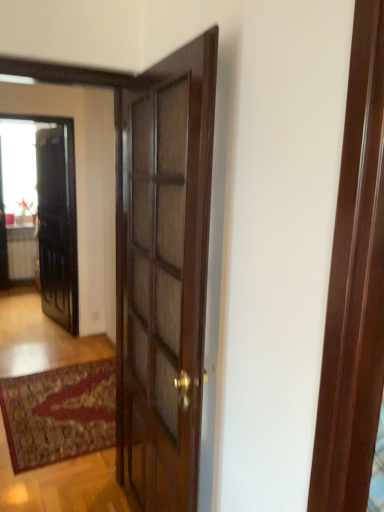
Question: From a real-world perspective, does black glossy elevator at left stand above transparent glass window at upper left?

Choices:
 (A) yes
 (B) no

Answer: (B)

Question: Is black glossy elevator at left next to transparent glass window at upper left and touching it?

Choices:
 (A) no
 (B) yes

Answer: (A)

Question: Is black glossy elevator at left facing towards transparent glass window at upper left?

Choices:
 (A) yes
 (B) no

Answer: (B)

Question: Is transparent glass window at upper left at the back of black glossy elevator at left?

Choices:
 (A) no
 (B) yes

Answer: (B)

Question: From a real-world perspective, is black glossy elevator at left positioned under transparent glass window at upper left based on gravity?

Choices:
 (A) no
 (B) yes

Answer: (B)

Question: Is glossy dark wood door at center bigger or smaller than white glossy radiator at lower left?

Choices:
 (A) big
 (B) small

Answer: (A)

Question: From the image's perspective, relative to white glossy radiator at lower left, is glossy dark wood door at center above or below?

Choices:
 (A) below
 (B) above

Answer: (B)

Question: In the image, is glossy dark wood door at center on the left side or the right side of white glossy radiator at lower left?

Choices:
 (A) right
 (B) left

Answer: (A)

Question: Considering the positions of glossy dark wood door at center and white glossy radiator at lower left in the image, is glossy dark wood door at center taller or shorter than white glossy radiator at lower left?

Choices:
 (A) tall
 (B) short

Answer: (A)

Question: Considering the positions of black glossy elevator at left and transparent glass window at upper left in the image, is black glossy elevator at left wider or thinner than transparent glass window at upper left?

Choices:
 (A) thin
 (B) wide

Answer: (B)

Question: Is black glossy elevator at left bigger or smaller than transparent glass window at upper left?

Choices:
 (A) big
 (B) small

Answer: (A)

Question: Would you say black glossy elevator at left is to the left or to the right of transparent glass window at upper left in the picture?

Choices:
 (A) left
 (B) right

Answer: (B)

Question: From the image's perspective, is black glossy elevator at left located above or below transparent glass window at upper left?

Choices:
 (A) above
 (B) below

Answer: (B)

Question: Looking at their shapes, would you say transparent glass window at upper left is wider or thinner than glossy dark wood door at center?

Choices:
 (A) thin
 (B) wide

Answer: (A)

Question: Considering their positions, is transparent glass window at upper left located in front of or behind glossy dark wood door at center?

Choices:
 (A) front
 (B) behind

Answer: (B)